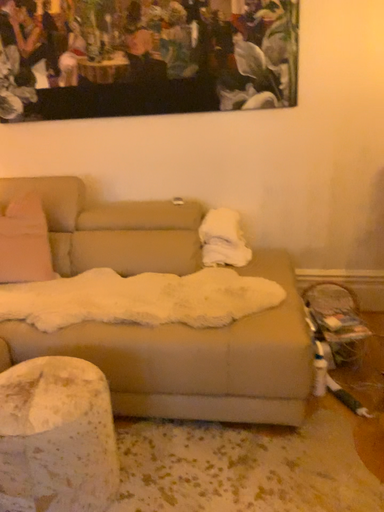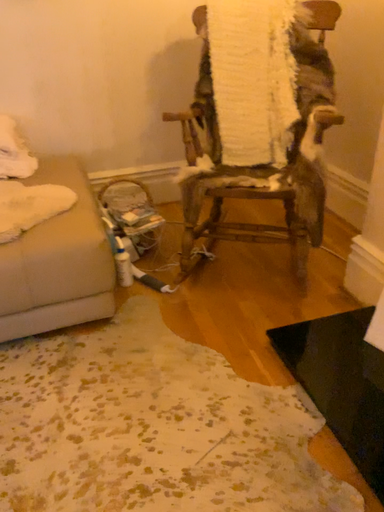
Question: Which way did the camera rotate in the video?

Choices:
 (A) rotated upward
 (B) rotated downward

Answer: (B)